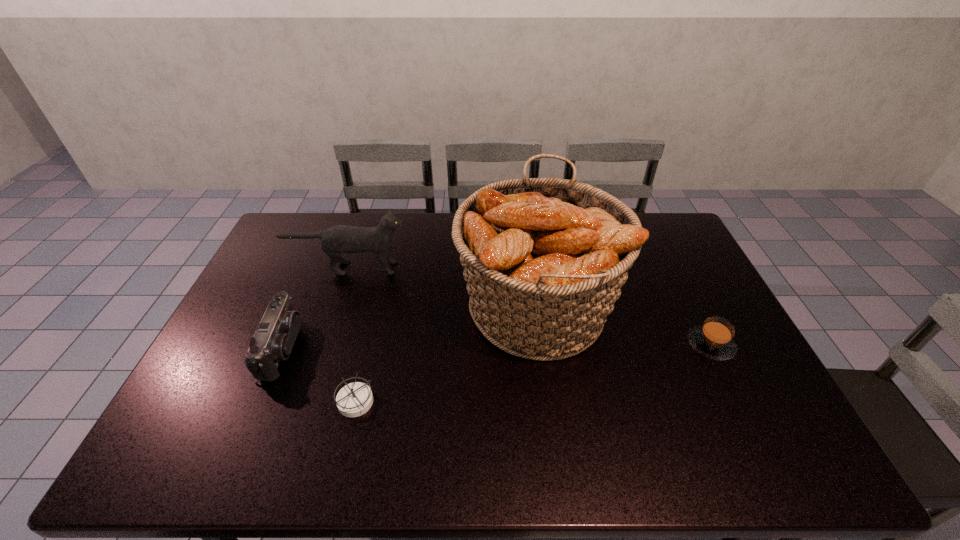
Locate an element on the screen. free space between the basket and the third tallest object is located at coordinates (410, 328).

Find the location of a particular element. The image size is (960, 540). free spot between the rightmost object and the nearest object is located at coordinates (533, 374).

At what (x,y) coordinates should I click in order to perform the action: click on empty location between the nearest object and the second tallest object. Please return your answer as a coordinate pair (x, y). The width and height of the screenshot is (960, 540). Looking at the image, I should click on (351, 335).

Find the location of a particular element. The width and height of the screenshot is (960, 540). empty space between the third shortest object and the basket is located at coordinates (410, 328).

The image size is (960, 540). I want to click on free spot between the cat and the third shortest object, so click(315, 308).

The image size is (960, 540). In order to click on vacant area between the cappuccino and the third tallest object in this screenshot , I will do click(496, 346).

Locate which object is the closest to the third shortest object. Please provide its 2D coordinates. Your answer should be formatted as a tuple, i.e. [(x, y)], where the tuple contains the x and y coordinates of a point satisfying the conditions above.

[(353, 400)]

Identify which object is the second nearest to the second tallest object. Please provide its 2D coordinates. Your answer should be formatted as a tuple, i.e. [(x, y)], where the tuple contains the x and y coordinates of a point satisfying the conditions above.

[(275, 336)]

Locate an element on the screen. free space that satisfies the following two spatial constraints: 1. on the front side of the second object from right to left; 2. on the right side of the rightmost object is located at coordinates (541, 345).

Locate an element on the screen. This screenshot has width=960, height=540. free space that satisfies the following two spatial constraints: 1. on the front-facing side of the third tallest object; 2. on the right side of the compass is located at coordinates (259, 403).